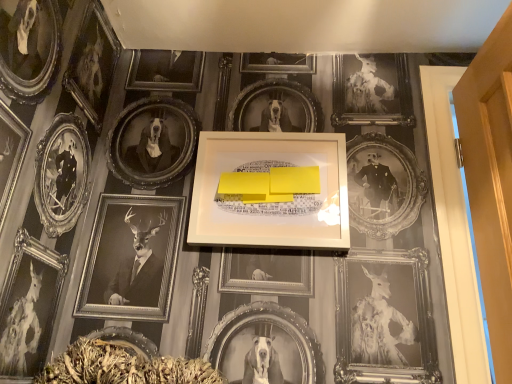
Where is `white matte picture frame at center`? white matte picture frame at center is located at coordinates (271, 191).

The width and height of the screenshot is (512, 384). What do you see at coordinates (271, 191) in the screenshot?
I see `white matte picture frame at center` at bounding box center [271, 191].

Locate an element on the screen. The image size is (512, 384). white matte picture frame at center is located at coordinates click(x=271, y=191).